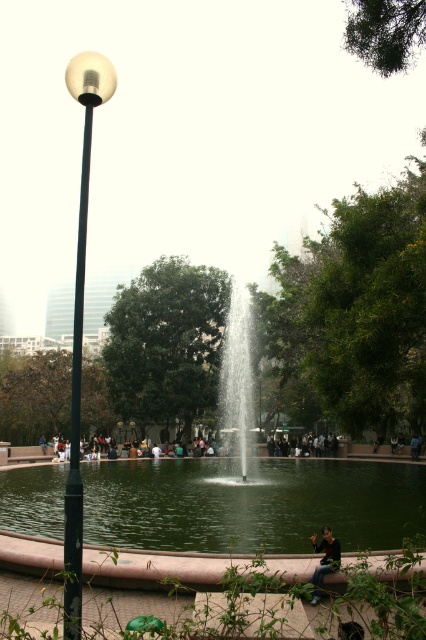
Question: Estimate the real-world distances between objects in this image. Which object is farther from the green concrete fountain at center?

Choices:
 (A) gold polished sphere at left
 (B) green liquid water at center
 (C) clear water fountain at center
 (D) dark green fabric jacket at lower center

Answer: (D)

Question: Which point is closer to the camera?

Choices:
 (A) dark green fabric jacket at lower center
 (B) clear water fountain at center
 (C) dark blue jeans at center
 (D) green concrete fountain at center

Answer: (A)

Question: Can you confirm if green concrete fountain at center is positioned below green liquid water at center?

Choices:
 (A) yes
 (B) no

Answer: (B)

Question: In this image, where is green liquid water at center located relative to dark blue jeans at center?

Choices:
 (A) right
 (B) left

Answer: (B)

Question: Which is farther from the green concrete fountain at center?

Choices:
 (A) dark green fabric jacket at lower center
 (B) green liquid water at center
 (C) dark blue jeans at center
 (D) clear water fountain at center

Answer: (A)

Question: Can you confirm if green liquid water at center is positioned to the right of dark green fabric jacket at lower center?

Choices:
 (A) no
 (B) yes

Answer: (A)